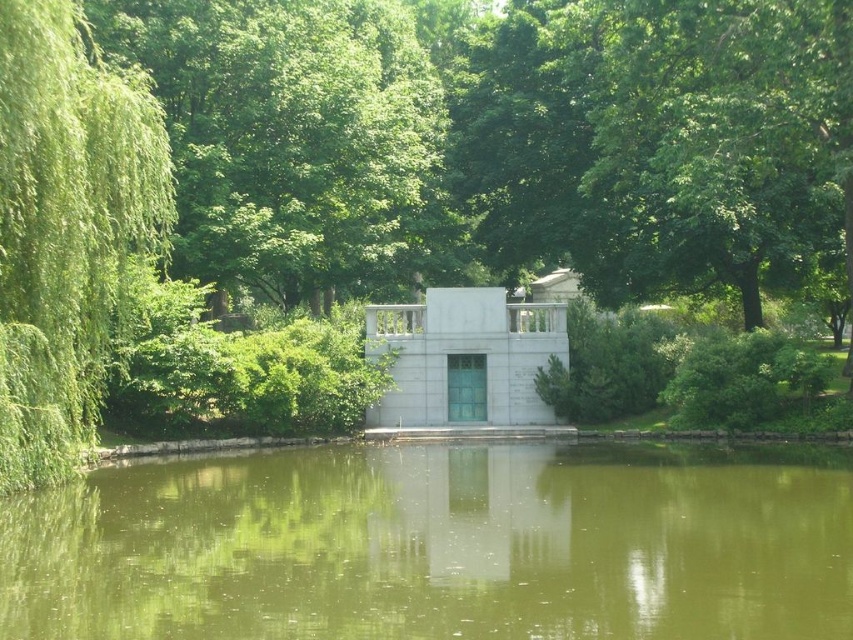
Question: Can you confirm if green leafy tree at upper left is positioned above green leafy tree at left?

Choices:
 (A) yes
 (B) no

Answer: (A)

Question: Estimate the real-world distances between objects in this image. Which object is farther from the green leafy tree at left?

Choices:
 (A) greenish murky water at center
 (B) green leafy tree at upper left

Answer: (B)

Question: Which point is farther to the camera?

Choices:
 (A) 799,486
 (B) 0,106

Answer: (A)

Question: Can you confirm if greenish murky water at center is positioned to the right of green leafy tree at left?

Choices:
 (A) yes
 (B) no

Answer: (A)

Question: Is greenish murky water at center bigger than green leafy tree at upper left?

Choices:
 (A) no
 (B) yes

Answer: (A)

Question: Which object appears closest to the camera in this image?

Choices:
 (A) green leafy tree at left
 (B) greenish murky water at center

Answer: (B)